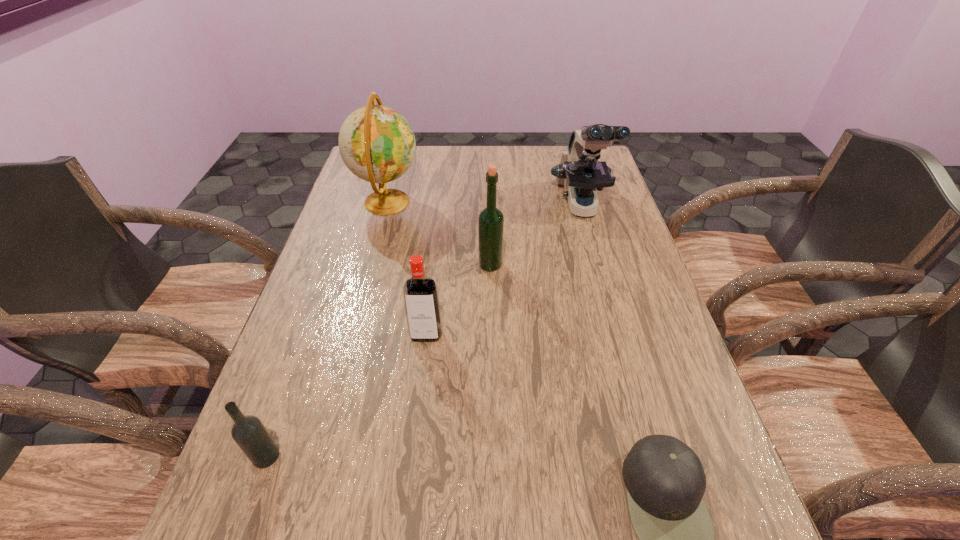
Locate an element on the screen. This screenshot has width=960, height=540. free space in the image that satisfies the following two spatial constraints: 1. on the front side of the third farthest object; 2. on the right side of the globe is located at coordinates (371, 265).